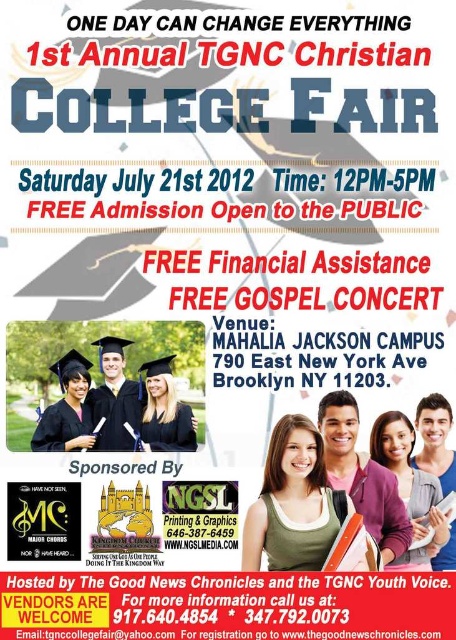
Question: Which of these objects is positioned farthest from the matte black jacket at center?

Choices:
 (A) matte black laptop at center
 (B) matte black hair at center

Answer: (A)

Question: Can you confirm if green fabric shirt at center is bigger than matte black hair at center?

Choices:
 (A) yes
 (B) no

Answer: (A)

Question: Can you confirm if matte black jacket at center is positioned below matte black hair at center?

Choices:
 (A) no
 (B) yes

Answer: (A)

Question: Observing the image, what is the correct spatial positioning of matte black jacket at center in reference to matte black graduation gown at center?

Choices:
 (A) below
 (B) above

Answer: (A)

Question: Which of these objects is positioned closest to the matte black jacket at center?

Choices:
 (A) matte white graduation gown at center
 (B) matte black laptop at center
 (C) matte black hair at center
 (D) green fabric shirt at center

Answer: (C)

Question: Estimate the real-world distances between objects in this image. Which object is farther from the matte black hair at center?

Choices:
 (A) matte black jacket at center
 (B) green fabric shirt at center
 (C) matte black laptop at center

Answer: (B)